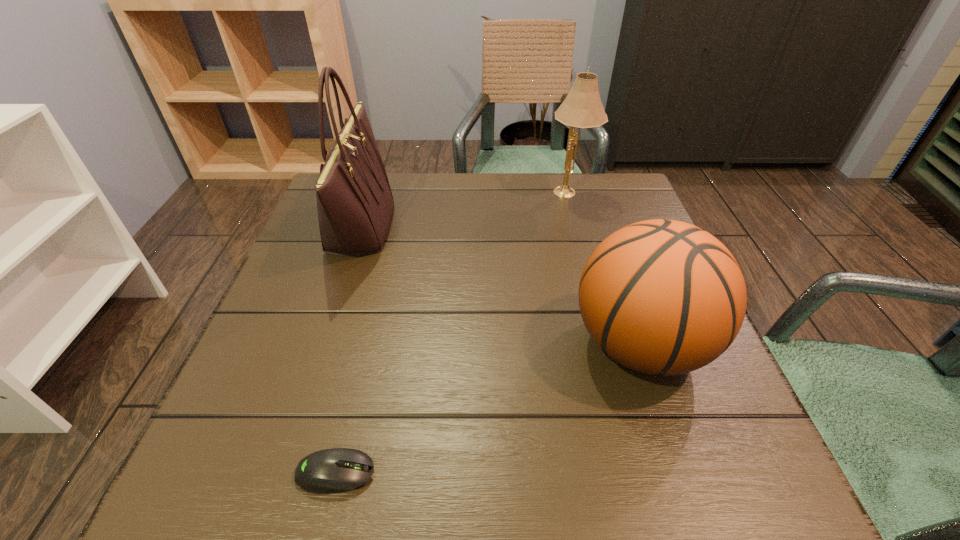
Locate an element on the screen. free region that satisfies the following two spatial constraints: 1. on the front-facing side of the handbag; 2. on the right side of the third tallest object is located at coordinates (321, 343).

You are a GUI agent. You are given a task and a screenshot of the screen. Output one action in this format:
    pyautogui.click(x=<x>, y=<y>)
    Task: Click on the free space that satisfies the following two spatial constraints: 1. on the back side of the basketball; 2. on the front-facing side of the handbag
    The height and width of the screenshot is (540, 960).
    Given the screenshot: What is the action you would take?
    pyautogui.click(x=600, y=226)

Where is `vacant space that satisfies the following two spatial constraints: 1. on the front side of the second nearest object; 2. on the wheel side of the nearest object`? This screenshot has height=540, width=960. vacant space that satisfies the following two spatial constraints: 1. on the front side of the second nearest object; 2. on the wheel side of the nearest object is located at coordinates (683, 473).

You are a GUI agent. You are given a task and a screenshot of the screen. Output one action in this format:
    pyautogui.click(x=<x>, y=<y>)
    Task: Click on the free spot that satisfies the following two spatial constraints: 1. on the front-facing side of the third farthest object; 2. on the right side of the handbag
    The height and width of the screenshot is (540, 960).
    Given the screenshot: What is the action you would take?
    pyautogui.click(x=321, y=343)

Where is `vacant region that satisfies the following two spatial constraints: 1. on the front side of the second shortest object; 2. on the wheel side of the nearest object`? The width and height of the screenshot is (960, 540). vacant region that satisfies the following two spatial constraints: 1. on the front side of the second shortest object; 2. on the wheel side of the nearest object is located at coordinates (683, 473).